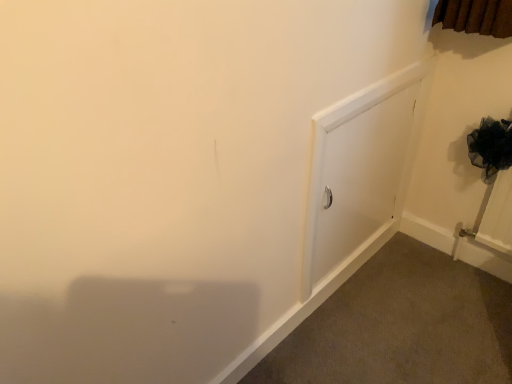
What is the approximate height of white matte screen door at upper right?

It is 66.97 centimeters.

What do you see at coordinates (356, 176) in the screenshot? This screenshot has height=384, width=512. I see `white matte screen door at upper right` at bounding box center [356, 176].

At what (x,y) coordinates should I click in order to perform the action: click on white matte screen door at upper right. Please return your answer as a coordinate pair (x, y). Looking at the image, I should click on (356, 176).

Find the location of `white matte screen door at upper right`. white matte screen door at upper right is located at coordinates (x=356, y=176).